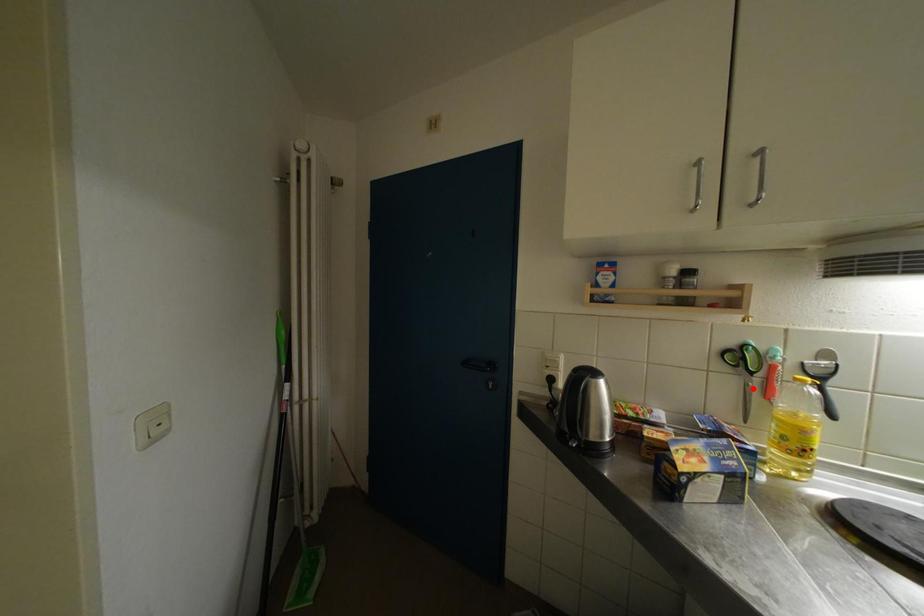
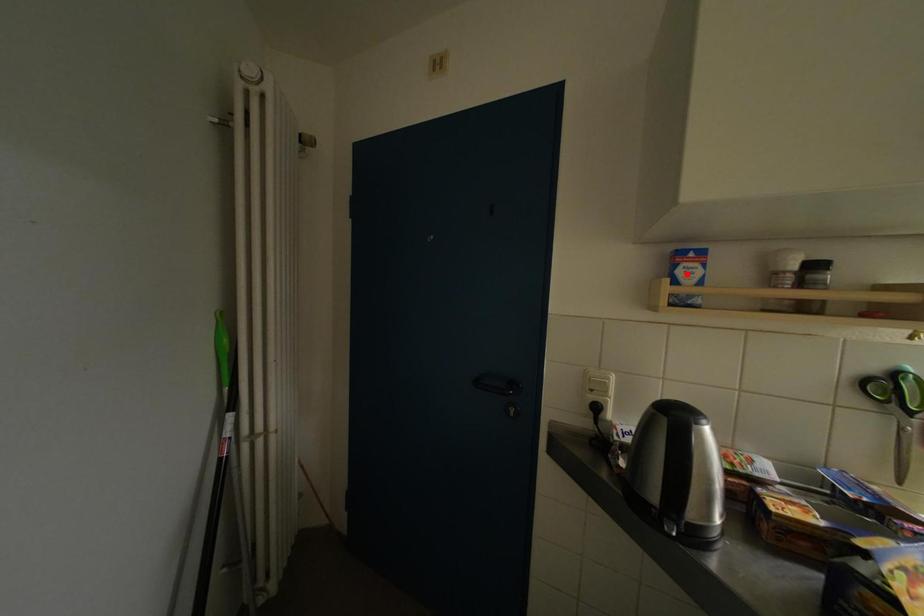
I am providing you with two images of the same scene from different viewpoints. A red point is marked on the first image and another point is marked on the second image. Are the points marked in image1 and image2 representing the same 3D position?

No